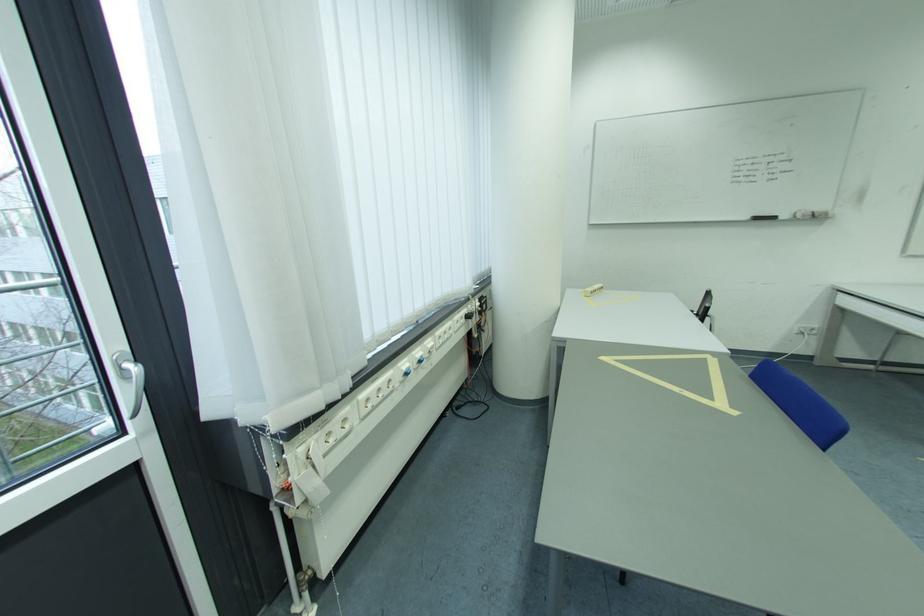
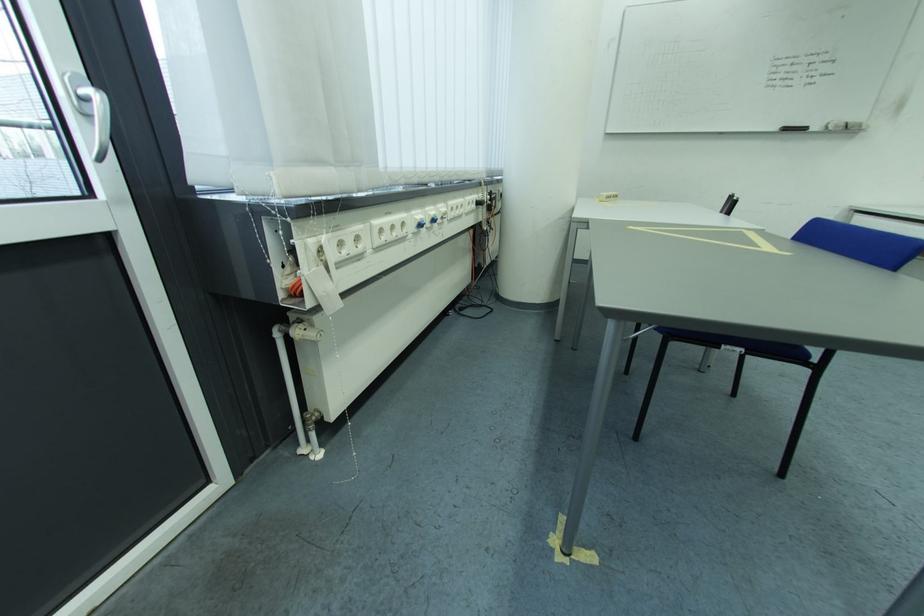
The point at (311, 432) is marked in the first image. Where is the corresponding point in the second image?

(322, 217)